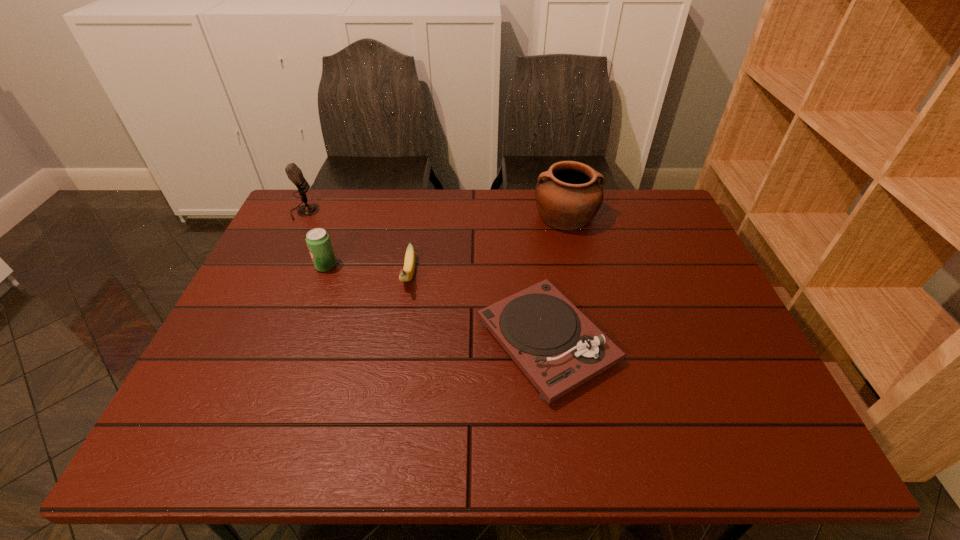
The width and height of the screenshot is (960, 540). I want to click on blank region between the leftmost object and the shortest object, so click(425, 276).

Locate an element on the screen. object that ranks as the closest to the leftmost object is located at coordinates (318, 241).

Identify which object is the fourth nearest to the phonograph_record. Please provide its 2D coordinates. Your answer should be formatted as a tuple, i.e. [(x, y)], where the tuple contains the x and y coordinates of a point satisfying the conditions above.

[(294, 173)]

The width and height of the screenshot is (960, 540). In order to click on vacant point that satisfies the following two spatial constraints: 1. on the front side of the shortest object; 2. on the right side of the second object from left to right in this screenshot , I will do `click(299, 341)`.

Find the location of a particular element. The width and height of the screenshot is (960, 540). vacant region that satisfies the following two spatial constraints: 1. on the front-facing side of the microphone; 2. on the right side of the pottery is located at coordinates tap(302, 216).

The width and height of the screenshot is (960, 540). I want to click on vacant space that satisfies the following two spatial constraints: 1. on the back side of the soda; 2. on the left side of the pottery, so click(345, 216).

At what (x,y) coordinates should I click in order to perform the action: click on vacant space that satisfies the following two spatial constraints: 1. on the front-facing side of the pottery; 2. on the left side of the leftmost object. Please return your answer as a coordinate pair (x, y). Looking at the image, I should click on (302, 216).